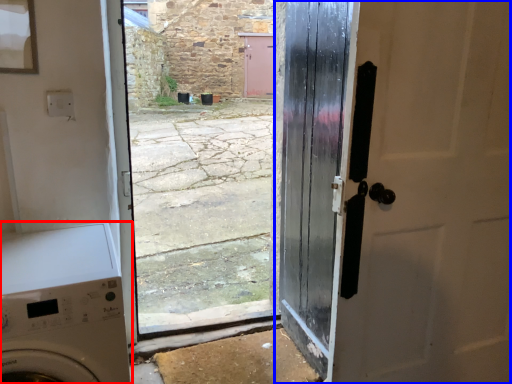
Question: Among these objects, which one is nearest to the camera, washing machine (highlighted by a red box) or door (highlighted by a blue box)?

Choices:
 (A) washing machine
 (B) door

Answer: (A)